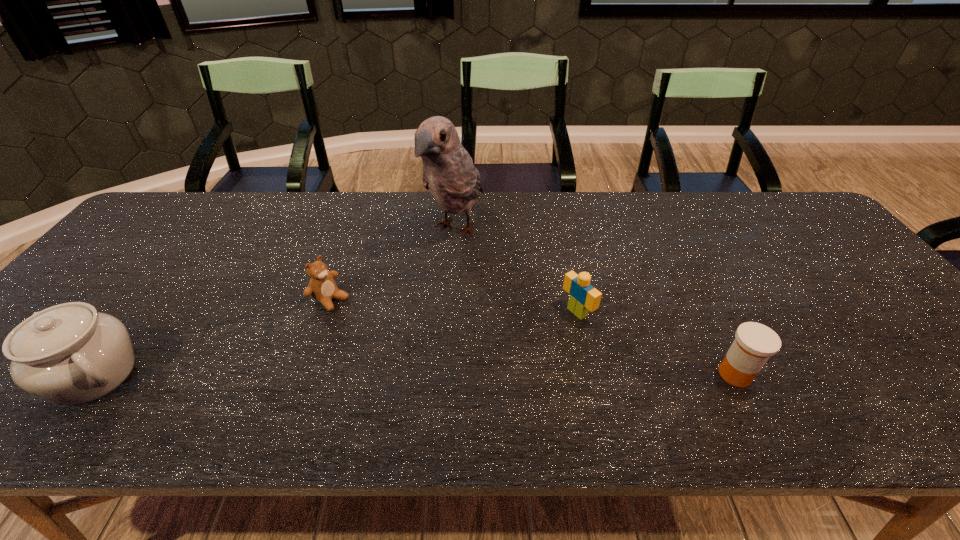
I want to click on vacant space located 0.160m on the front-facing side of the fourth object from right to left, so click(x=390, y=337).

Locate an element on the screen. vacant space positioned on the face of the Lego is located at coordinates (447, 391).

This screenshot has width=960, height=540. Identify the location of vacant space located on the face of the Lego. (478, 373).

I want to click on free location located 0.240m on the face of the Lego, so click(x=486, y=368).

Locate an element on the screen. The width and height of the screenshot is (960, 540). vacant space situated 0.190m on the front-facing side of the third object from right to left is located at coordinates (406, 305).

Locate an element on the screen. Image resolution: width=960 pixels, height=540 pixels. vacant space located 0.060m on the front-facing side of the third object from right to left is located at coordinates (431, 273).

At what (x,y) coordinates should I click in order to perform the action: click on vacant space located on the front-facing side of the third object from right to left. Please return your answer as a coordinate pair (x, y). The width and height of the screenshot is (960, 540). Looking at the image, I should click on (372, 348).

Locate an element on the screen. object that is at the far edge is located at coordinates (449, 174).

Locate an element on the screen. chinaware located in the near edge section of the desktop is located at coordinates (70, 354).

The height and width of the screenshot is (540, 960). I want to click on medicine that is at the near edge, so click(x=754, y=343).